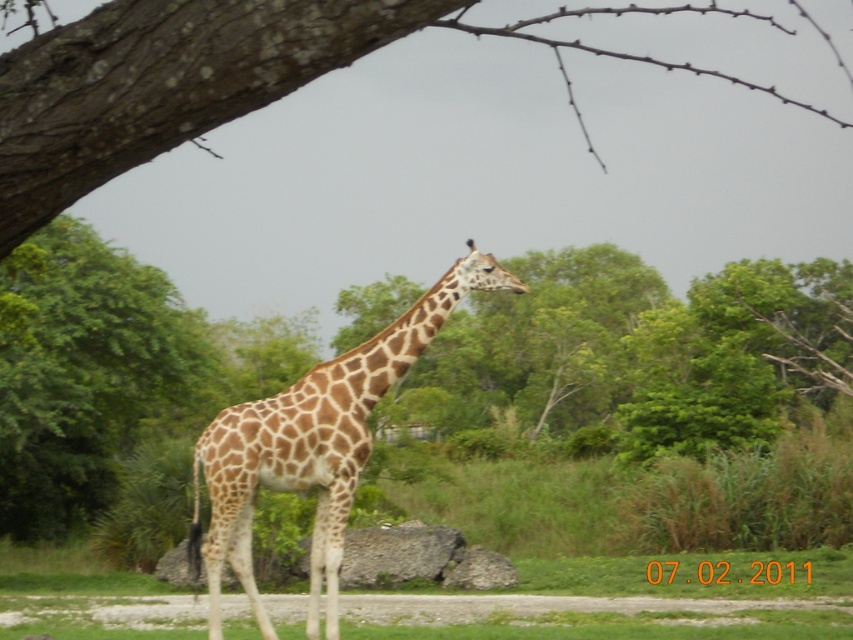
Is brown rough bark at upper left thinner than spotted fur giraffe at center?

In fact, brown rough bark at upper left might be wider than spotted fur giraffe at center.

Is point (28, 129) behind point (257, 428)?

No, it is in front of (257, 428).

Where is `brown rough bark at upper left`? The image size is (853, 640). brown rough bark at upper left is located at coordinates (163, 83).

At what (x,y) coordinates should I click in order to perform the action: click on green grass at lower center. Please return your answer as a coordinate pair (x, y). Looking at the image, I should click on tap(660, 579).

Is green grass at lower center smaller than spotted fur giraffe at center?

Actually, green grass at lower center might be larger than spotted fur giraffe at center.

Identify the location of green grass at lower center. This screenshot has width=853, height=640. (660, 579).

The image size is (853, 640). I want to click on green grass at lower center, so click(660, 579).

Is point (103, 19) closer to viewer compared to point (270, 602)?

Yes.

Can you confirm if brown rough bark at upper left is shorter than green grass at lower center?

Yes, brown rough bark at upper left is shorter than green grass at lower center.

Does point (62, 180) come closer to viewer compared to point (520, 634)?

Yes, it is in front of point (520, 634).

Find the location of `brown rough bark at upper left`. brown rough bark at upper left is located at coordinates (163, 83).